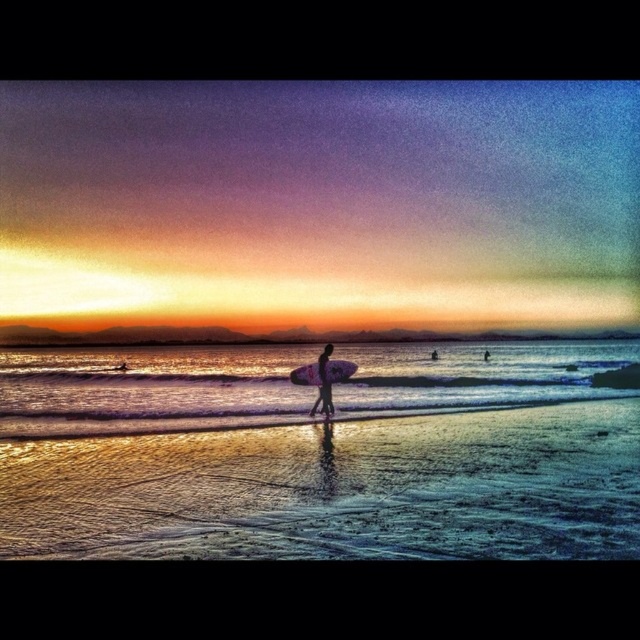
Is sandy beach at center above silhouette surfboard at center?

Actually, sandy beach at center is below silhouette surfboard at center.

Does point (65, 518) come closer to viewer compared to point (323, 371)?

Yes, it is in front of point (323, 371).

Locate an element on the screen. sandy beach at center is located at coordinates (337, 490).

Does sandy beach at center have a greater width compared to shiny silver water at center?

No.

Is sandy beach at center below shiny silver water at center?

No.

Does point (44, 467) come in front of point (448, 355)?

Yes, point (44, 467) is in front of point (448, 355).

In order to click on sandy beach at center in this screenshot , I will do pyautogui.click(x=337, y=490).

Can you confirm if sandy beach at center is positioned to the right of white foam surfboard at center?

Indeed, sandy beach at center is positioned on the right side of white foam surfboard at center.

Is sandy beach at center positioned behind white foam surfboard at center?

That is False.

Describe the element at coordinates (337, 490) in the screenshot. I see `sandy beach at center` at that location.

Find the location of a particular element. This screenshot has width=640, height=640. sandy beach at center is located at coordinates (337, 490).